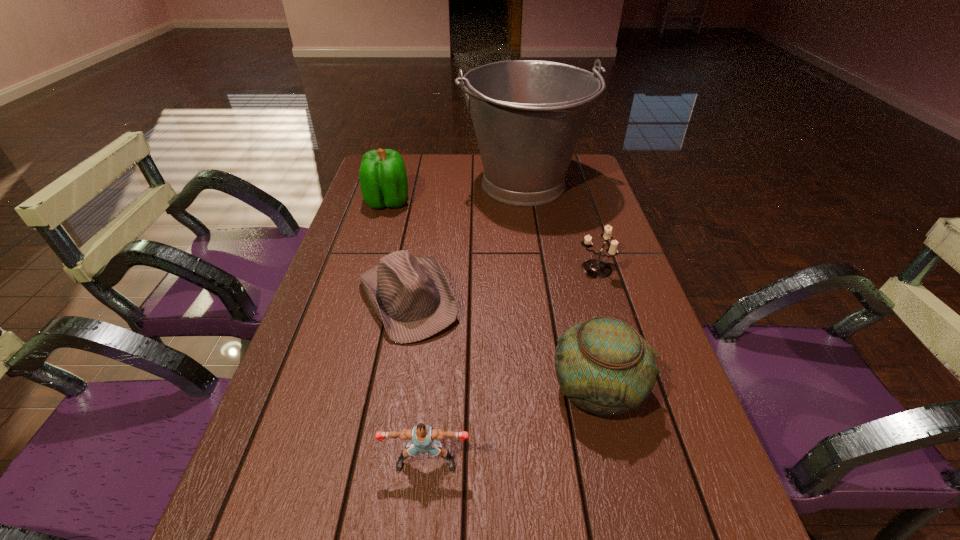
I want to click on vacant area that lies between the candle holder and the bucket, so click(559, 226).

Locate an element on the screen. This screenshot has height=540, width=960. free space between the puncher and the tallest object is located at coordinates (475, 323).

Locate which object is the third closest to the fedora. Please provide its 2D coordinates. Your answer should be formatted as a tuple, i.e. [(x, y)], where the tuple contains the x and y coordinates of a point satisfying the conditions above.

[(383, 179)]

Identify which object is the fourth closest to the bucket. Please provide its 2D coordinates. Your answer should be formatted as a tuple, i.e. [(x, y)], where the tuple contains the x and y coordinates of a point satisfying the conditions above.

[(603, 365)]

This screenshot has width=960, height=540. I want to click on vacant area in the image that satisfies the following two spatial constraints: 1. on the front side of the fedora; 2. on the right side of the third tallest object, so click(x=393, y=389).

Find the location of `free point that satisfies the following two spatial constraints: 1. on the front side of the candle holder; 2. on the left side of the bucket`. free point that satisfies the following two spatial constraints: 1. on the front side of the candle holder; 2. on the left side of the bucket is located at coordinates (537, 268).

This screenshot has height=540, width=960. In order to click on vacant region that satisfies the following two spatial constraints: 1. on the front side of the fourth shortest object; 2. on the right side of the fedora in this screenshot , I will do `click(393, 389)`.

At what (x,y) coordinates should I click in order to perform the action: click on free location that satisfies the following two spatial constraints: 1. on the front side of the fedora; 2. on the right side of the fifth farthest object. Please return your answer as a coordinate pair (x, y). Image resolution: width=960 pixels, height=540 pixels. Looking at the image, I should click on (393, 389).